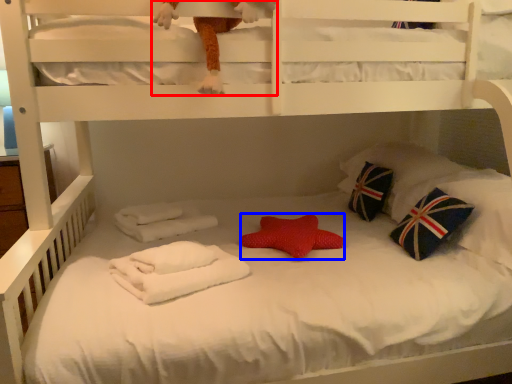
Question: Which point is further to the camera, toy (highlighted by a red box) or throw pillow (highlighted by a blue box)?

Choices:
 (A) toy
 (B) throw pillow

Answer: (B)